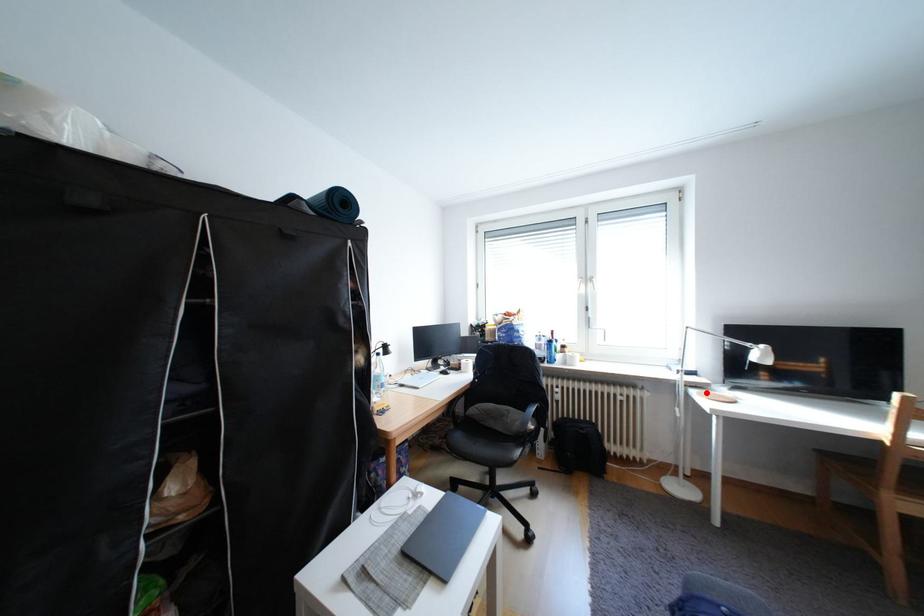
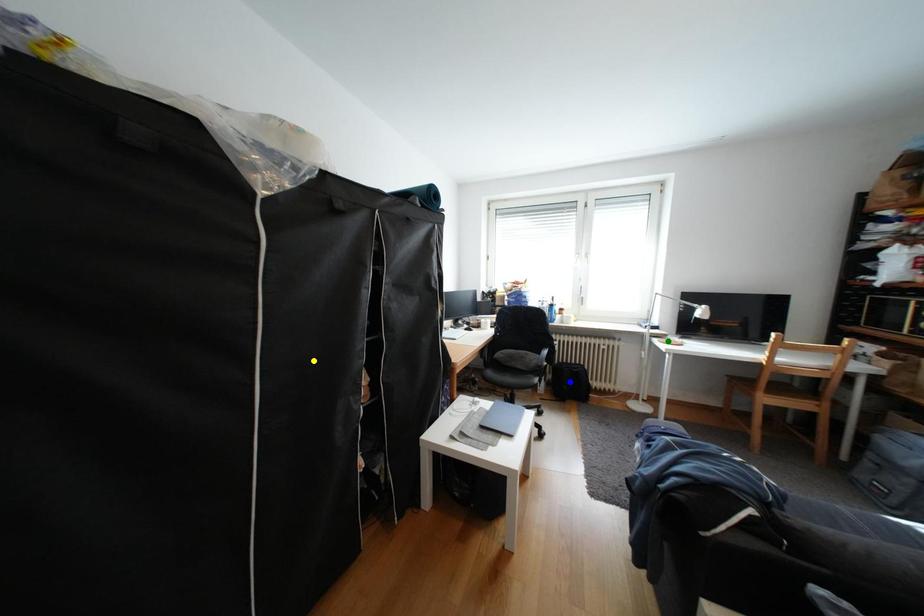
Question: I am providing you with two images of the same scene from different viewpoints. A red point is marked on the first image. You are given multiple points on the second image. Which point in image 2 represents the same 3d spot as the red point in image 1?

Choices:
 (A) green point
 (B) yellow point
 (C) blue point

Answer: (A)